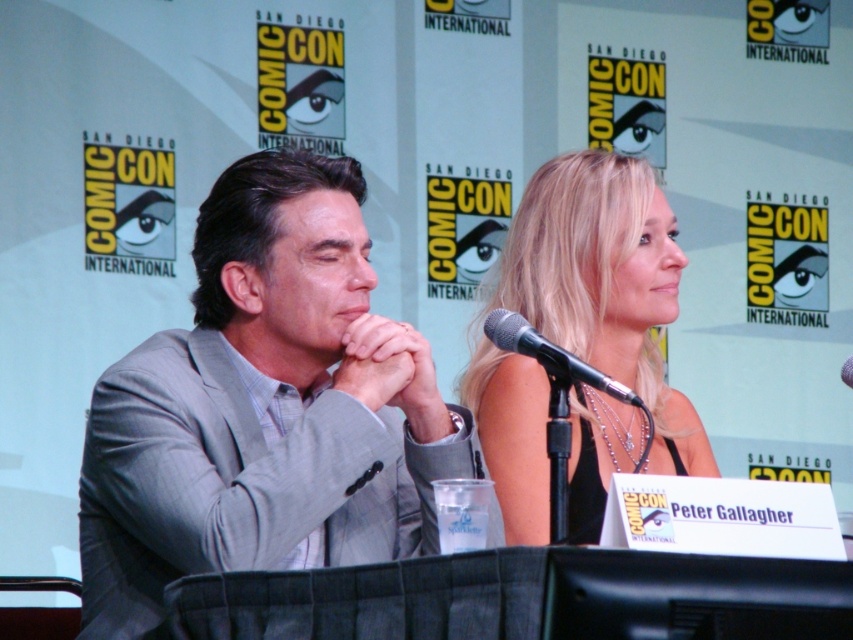
You are an event photographer at ComicCon. You want to take a photo of the gray suit at center and the blonde hair at center such that both are in focus. The camera you are using has a depth of field that can cover 35 inches. Will both subjects be in focus?

The gray suit at center and blonde hair at center are 35.18 inches apart from each other. Since the camera can cover 35 inches, the distance between them is slightly beyond the depth of field. Therefore, both subjects may not be fully in focus.

You are an attendee at Comic Con and want to take a photo of the panel discussion. You notice the blonde hair at center and the black metallic microphone at center. Which object should you focus on if you want to capture the larger one in your photo?

The blonde hair at center is bigger than the black metallic microphone at center, so you should focus on the blonde hair at center to capture the larger one in your photo.